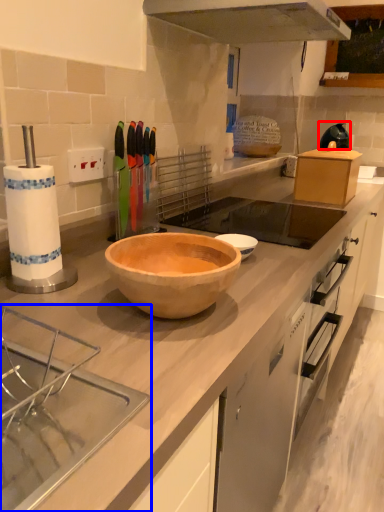
Question: Which object is further to the camera taking this photo, appliance (highlighted by a red box) or sink (highlighted by a blue box)?

Choices:
 (A) appliance
 (B) sink

Answer: (A)